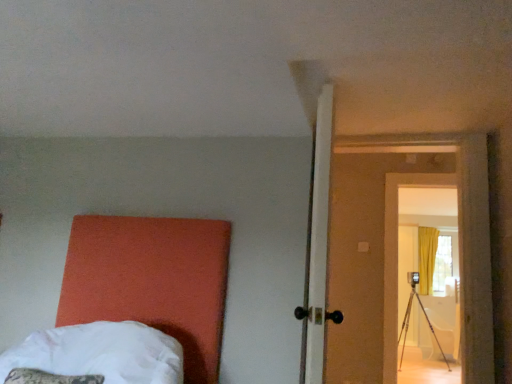
Question: From the image's perspective, is white soft bed at lower left above wooden door at center-right?

Choices:
 (A) no
 (B) yes

Answer: (A)

Question: Does white soft bed at lower left have a larger size compared to wooden door at center-right?

Choices:
 (A) no
 (B) yes

Answer: (A)

Question: Does white soft bed at lower left have a lesser width compared to wooden door at center-right?

Choices:
 (A) yes
 (B) no

Answer: (B)

Question: Considering the relative positions of white soft bed at lower left and wooden door at center-right in the image provided, is white soft bed at lower left to the left of wooden door at center-right from the viewer's perspective?

Choices:
 (A) yes
 (B) no

Answer: (A)

Question: From a real-world perspective, is white soft bed at lower left positioned under wooden door at center-right based on gravity?

Choices:
 (A) yes
 (B) no

Answer: (A)

Question: Is wooden door at center-right surrounded by white soft bed at lower left?

Choices:
 (A) yes
 (B) no

Answer: (B)

Question: Is wooden door at center-right next to white soft bed at lower left?

Choices:
 (A) yes
 (B) no

Answer: (B)

Question: Does wooden door at center-right have a lesser height compared to white soft bed at lower left?

Choices:
 (A) no
 (B) yes

Answer: (A)

Question: Is the position of wooden door at center-right more distant than that of white soft bed at lower left?

Choices:
 (A) no
 (B) yes

Answer: (B)

Question: Can you confirm if wooden door at center-right is wider than white soft bed at lower left?

Choices:
 (A) yes
 (B) no

Answer: (B)

Question: Can you confirm if wooden door at center-right is positioned to the right of white soft bed at lower left?

Choices:
 (A) no
 (B) yes

Answer: (B)

Question: Is wooden door at center-right at the left side of white soft bed at lower left?

Choices:
 (A) no
 (B) yes

Answer: (A)

Question: In the image, is wooden door at center-right on the left side or the right side of white soft bed at lower left?

Choices:
 (A) right
 (B) left

Answer: (A)